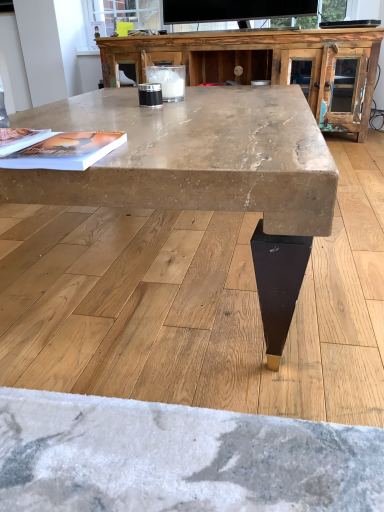
Question: From a real-world perspective, is marble-like wood coffee table at center over matte paper magazine at center, the 2th magazine in the left-to-right sequence?

Choices:
 (A) no
 (B) yes

Answer: (A)

Question: Does marble-like wood coffee table at center have a smaller size compared to matte paper magazine at center, which appears as the 1th magazine when viewed from the right?

Choices:
 (A) no
 (B) yes

Answer: (A)

Question: Considering the relative sizes of marble-like wood coffee table at center and matte paper magazine at center, the 2th magazine in the left-to-right sequence, in the image provided, is marble-like wood coffee table at center shorter than matte paper magazine at center, the 2th magazine in the left-to-right sequence,?

Choices:
 (A) yes
 (B) no

Answer: (B)

Question: Is marble-like wood coffee table at center not inside matte paper magazine at center, the 2th magazine in the left-to-right sequence?

Choices:
 (A) yes
 (B) no

Answer: (A)

Question: Is marble-like wood coffee table at center oriented towards matte paper magazine at center, the 2th magazine in the left-to-right sequence?

Choices:
 (A) yes
 (B) no

Answer: (B)

Question: From the image's perspective, is marble-like wood coffee table at center under matte paper magazine at center, which appears as the 1th magazine when viewed from the right?

Choices:
 (A) yes
 (B) no

Answer: (B)

Question: Does matte paper magazine at upper left, which is the second magazine from right to left, have a lesser height compared to marble-like wood coffee table at center?

Choices:
 (A) no
 (B) yes

Answer: (B)

Question: Is there a large distance between matte paper magazine at upper left, which is the second magazine from right to left, and marble-like wood coffee table at center?

Choices:
 (A) no
 (B) yes

Answer: (A)

Question: Can you confirm if matte paper magazine at upper left, which is the second magazine from right to left, is wider than marble-like wood coffee table at center?

Choices:
 (A) yes
 (B) no

Answer: (B)

Question: Does matte paper magazine at upper left, placed as the first magazine when sorted from left to right, have a larger size compared to marble-like wood coffee table at center?

Choices:
 (A) yes
 (B) no

Answer: (B)

Question: Considering the relative positions of matte paper magazine at upper left, placed as the first magazine when sorted from left to right, and marble-like wood coffee table at center in the image provided, is matte paper magazine at upper left, placed as the first magazine when sorted from left to right, behind marble-like wood coffee table at center?

Choices:
 (A) yes
 (B) no

Answer: (A)

Question: Considering the relative sizes of matte paper magazine at upper left, which is the second magazine from right to left, and marble-like wood coffee table at center in the image provided, is matte paper magazine at upper left, which is the second magazine from right to left, taller than marble-like wood coffee table at center?

Choices:
 (A) no
 (B) yes

Answer: (A)

Question: Is matte paper magazine at upper left, placed as the first magazine when sorted from left to right, located outside matte paper magazine at center, which appears as the 1th magazine when viewed from the right?

Choices:
 (A) yes
 (B) no

Answer: (A)